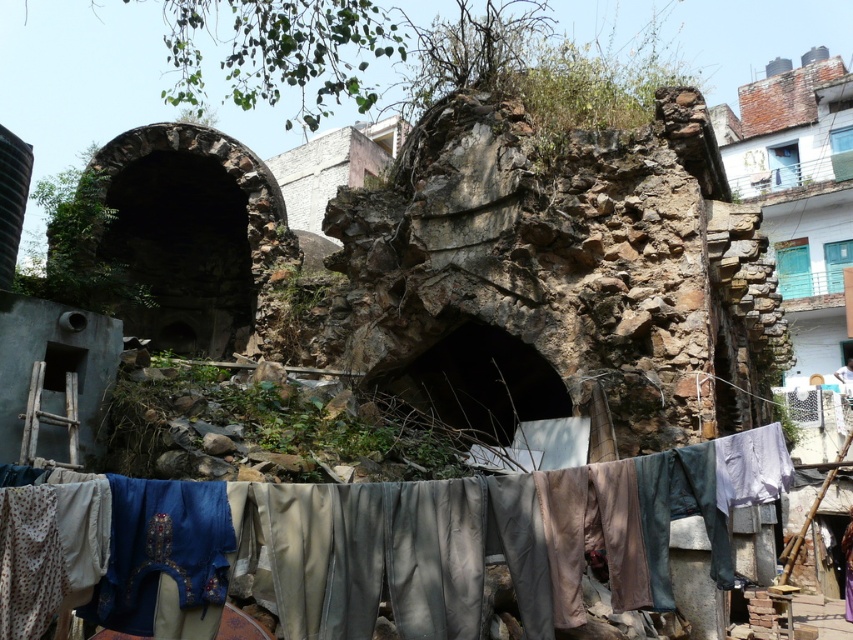
Is textured fabric clothesline at center above rusty stone arch at upper center?

No.

Can you confirm if textured fabric clothesline at center is thinner than rusty stone arch at upper center?

No.

You are a GUI agent. You are given a task and a screenshot of the screen. Output one action in this format:
    pyautogui.click(x=<x>, y=<y>)
    Task: Click on the textured fabric clothesline at center
    The image size is (853, 640).
    Given the screenshot: What is the action you would take?
    pyautogui.click(x=454, y=547)

This screenshot has width=853, height=640. I want to click on textured fabric clothesline at center, so click(454, 547).

Can you confirm if rustic stone wall at upper right is positioned to the right of rusty stone arch at upper center?

Correct, you'll find rustic stone wall at upper right to the right of rusty stone arch at upper center.

Which is behind, point (838, 296) or point (312, 184)?

Positioned behind is point (838, 296).

Find the location of a particular element. The height and width of the screenshot is (640, 853). rustic stone wall at upper right is located at coordinates (799, 195).

Is textured fabric clothesline at center to the left of rustic stone wall at upper right from the viewer's perspective?

Indeed, textured fabric clothesline at center is positioned on the left side of rustic stone wall at upper right.

Is textured fabric clothesline at center bigger than rustic stone wall at upper right?

Incorrect, textured fabric clothesline at center is not larger than rustic stone wall at upper right.

Which is behind, point (573, 500) or point (844, 109)?

The point (844, 109) is more distant.

Where is `textured fabric clothesline at center`? The width and height of the screenshot is (853, 640). textured fabric clothesline at center is located at coordinates (454, 547).